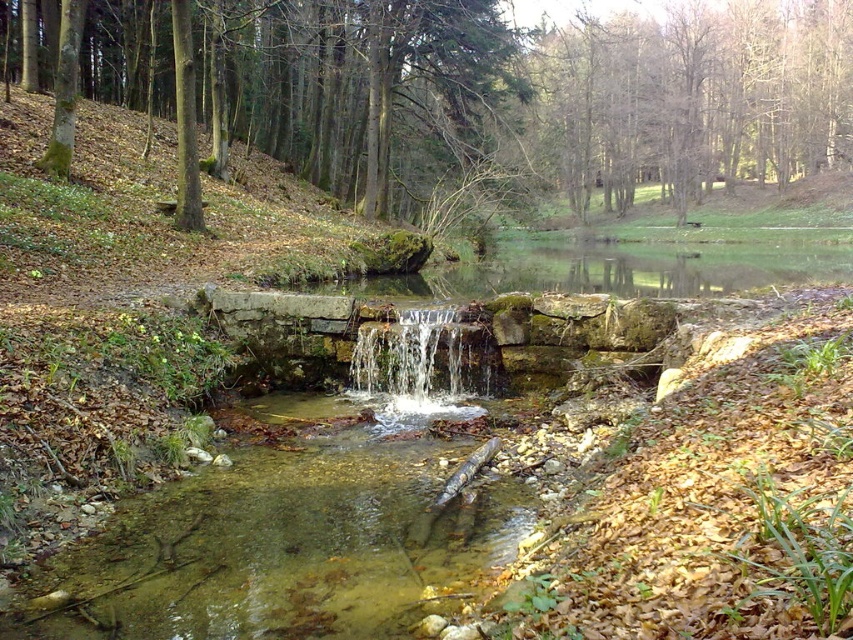
You are a hiker who wants to cross the stream using the fallen log. You notice the clear stone waterfall at center and the bare wood trees at upper center. Which object is located above the other?

The bare wood trees at upper center are positioned over the clear stone waterfall at center, so the trees are above the waterfall.

You are standing at the point labeled point (x=462, y=394) and want to walk to the point labeled point (x=817, y=16). Based on the scene description, which direction should you face to move towards your destination?

Point (x=817, y=16) is behind point (x=462, y=394), so you should face away from the waterfall to move towards your destination.

You are an observer looking at the serene natural scene. You notice two types of trees at the upper center of the image. Which tree is closer to the viewer between the brown wood tree at upper center and the bare wood trees at upper center?

The brown wood tree at upper center is positioned under the bare wood trees at upper center, so the bare wood trees at upper center are closer to the viewer.